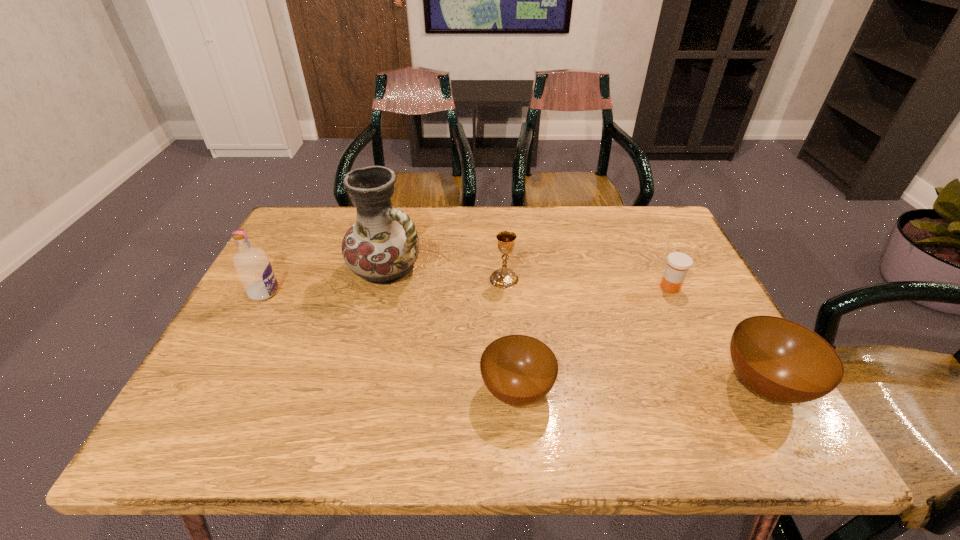
At what (x,y) coordinates should I click in order to perform the action: click on vacant region located 0.270m on the back of the chalice. Please return your answer as a coordinate pair (x, y). Image resolution: width=960 pixels, height=540 pixels. Looking at the image, I should click on (500, 215).

The height and width of the screenshot is (540, 960). I want to click on vacant space located on the label of the vodka, so click(x=310, y=292).

What are the coordinates of `free space located 0.250m on the front of the tallest object` in the screenshot? It's located at (361, 376).

Find the location of a particular element. free space located 0.180m on the label of the medicine is located at coordinates (588, 287).

Where is `vacant space located 0.150m on the label of the medicine`? vacant space located 0.150m on the label of the medicine is located at coordinates (600, 287).

This screenshot has height=540, width=960. I want to click on vacant space situated on the label of the medicine, so click(639, 287).

Identify the location of object present at the far edge. (382, 246).

Where is `object at the left edge`? object at the left edge is located at coordinates (253, 267).

This screenshot has height=540, width=960. I want to click on bowl that is at the right edge, so click(x=781, y=360).

Locate an element on the screen. This screenshot has height=540, width=960. medicine that is positioned at the right edge is located at coordinates (x=678, y=264).